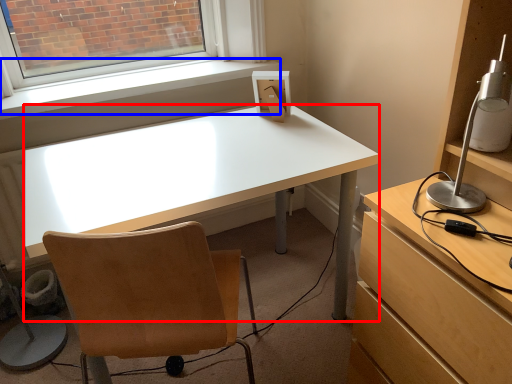
Question: Which point is closer to the camera, desk (highlighted by a red box) or window sill (highlighted by a blue box)?

Choices:
 (A) desk
 (B) window sill

Answer: (A)